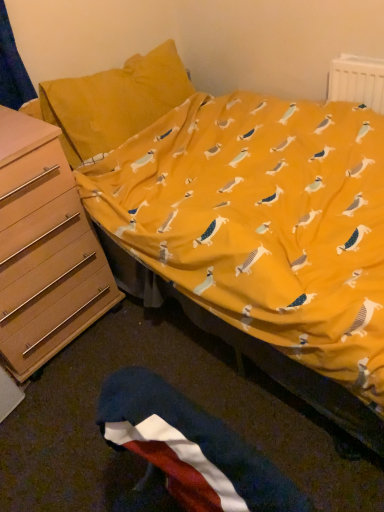
Question: Visually, is light brown wooden chest of drawers at left positioned to the left or to the right of polyester flag at lower center?

Choices:
 (A) left
 (B) right

Answer: (A)

Question: From the image's perspective, is light brown wooden chest of drawers at left above or below polyester flag at lower center?

Choices:
 (A) above
 (B) below

Answer: (A)

Question: Based on their relative distances, which object is farther from the polyester flag at lower center?

Choices:
 (A) light brown wooden chest of drawers at left
 (B) white plastic radiator at upper right

Answer: (B)

Question: Which object is positioned closest to the polyester flag at lower center?

Choices:
 (A) white plastic radiator at upper right
 (B) light brown wooden chest of drawers at left

Answer: (B)